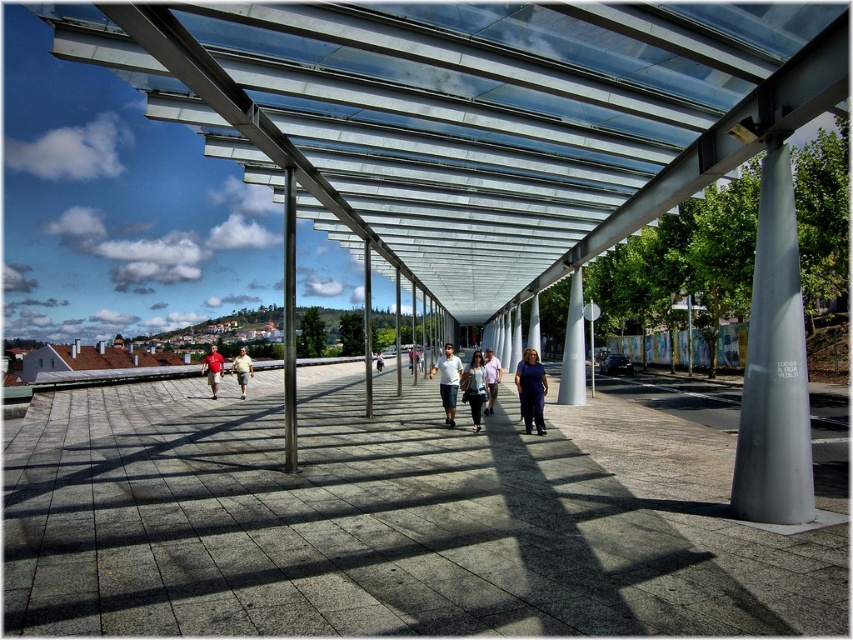
Question: Does gray concrete path at center have a lesser width compared to light brown fabric shirt at left?

Choices:
 (A) no
 (B) yes

Answer: (A)

Question: Considering the relative positions of white glossy pillar at center and light brown fabric shirt at left in the image provided, where is white glossy pillar at center located with respect to light brown fabric shirt at left?

Choices:
 (A) left
 (B) right

Answer: (B)

Question: Which point is farther from the camera taking this photo?

Choices:
 (A) (538, 408)
 (B) (793, 312)
 (C) (432, 371)

Answer: (C)

Question: Which object is the farthest from the matte blue dress at center?

Choices:
 (A) red shirt at left
 (B) light brown leather jacket at center
 (C) satin silver column at right
 (D) matte white shirt at center

Answer: (B)

Question: Is denim shorts at center closer to the viewer compared to matte white shirt at center?

Choices:
 (A) no
 (B) yes

Answer: (B)

Question: Which point appears farthest from the camera in this image?

Choices:
 (A) (450, 346)
 (B) (242, 371)
 (C) (463, 371)
 (D) (379, 355)

Answer: (D)